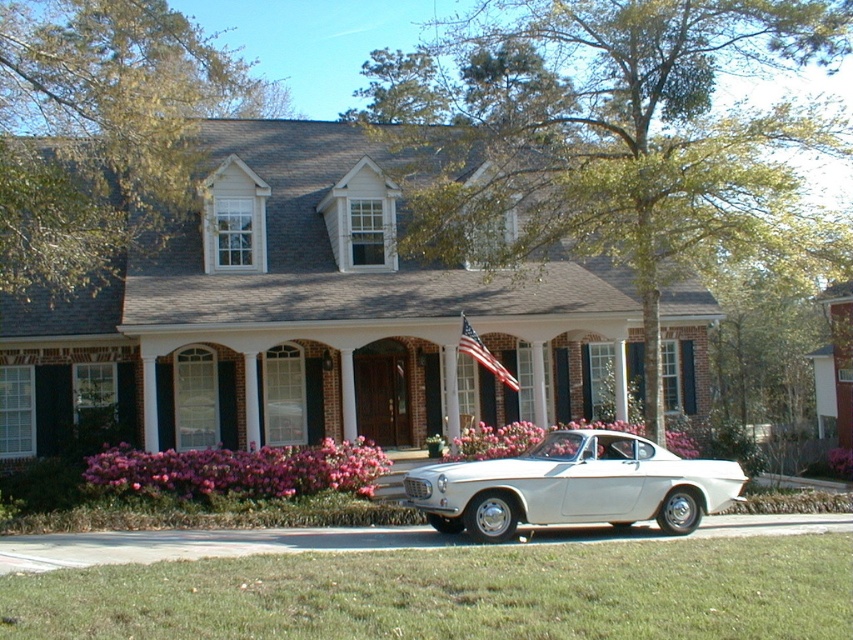
Is pink matte flowers at center below american flag at center?

Indeed, pink matte flowers at center is positioned under american flag at center.

Is point (503, 433) positioned behind point (469, 340)?

Yes, point (503, 433) is farther from viewer.

This screenshot has height=640, width=853. Identify the location of pink matte flowers at center. (518, 436).

Who is positioned more to the right, white glossy car at center or pink matte flowers at center?

white glossy car at center is more to the right.

Does white glossy car at center appear under pink matte flowers at center?

Incorrect, white glossy car at center is not positioned below pink matte flowers at center.

Who is more distant from viewer, (430,470) or (672,433)?

The point (672,433) is more distant.

You are a GUI agent. You are given a task and a screenshot of the screen. Output one action in this format:
    pyautogui.click(x=<x>, y=<y>)
    Task: Click on the white glossy car at center
    
    Given the screenshot: What is the action you would take?
    [x=573, y=486]

Which of these two, white glossy car at center or pink matte flowers at lower center, stands shorter?

pink matte flowers at lower center

Find the location of `white glossy car at center`. white glossy car at center is located at coordinates (573, 486).